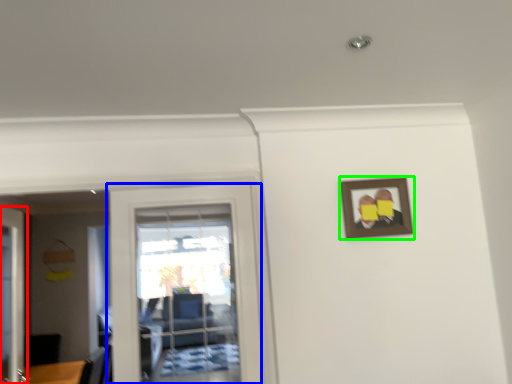
Question: Estimate the real-world distances between objects in this image. Which object is closer to door (highlighted by a red box), door (highlighted by a blue box) or picture frame (highlighted by a green box)?

Choices:
 (A) door
 (B) picture frame

Answer: (A)